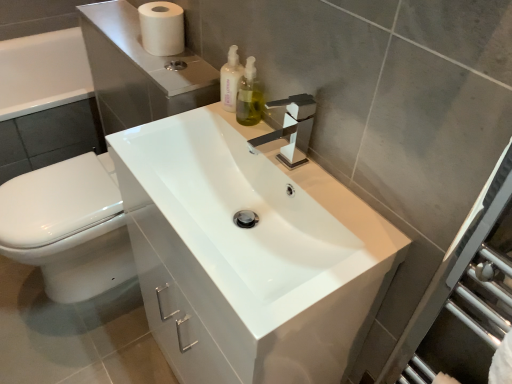
Question: Considering the positions of point (175, 168) and point (152, 16), is point (175, 168) closer or farther from the camera than point (152, 16)?

Choices:
 (A) closer
 (B) farther

Answer: (A)

Question: Is white glossy sink at center wider or thinner than white matte toilet paper at upper left?

Choices:
 (A) wide
 (B) thin

Answer: (A)

Question: Which object is positioned closest to the white matte toilet paper at upper left?

Choices:
 (A) white glossy sink at center
 (B) green glass soap dispenser at upper center, arranged as the 2th soap dispenser when viewed from the left
 (C) white glossy toilet at lower left
 (D) translucent plastic soap dispenser at upper center, the 1th soap dispenser in the left-to-right sequence

Answer: (D)

Question: Considering the real-world distances, which object is farthest from the translucent plastic soap dispenser at upper center, which appears as the 2th soap dispenser when viewed from the right?

Choices:
 (A) green glass soap dispenser at upper center, the first soap dispenser from the right
 (B) white glossy toilet at lower left
 (C) white matte toilet paper at upper left
 (D) white glossy sink at center

Answer: (B)